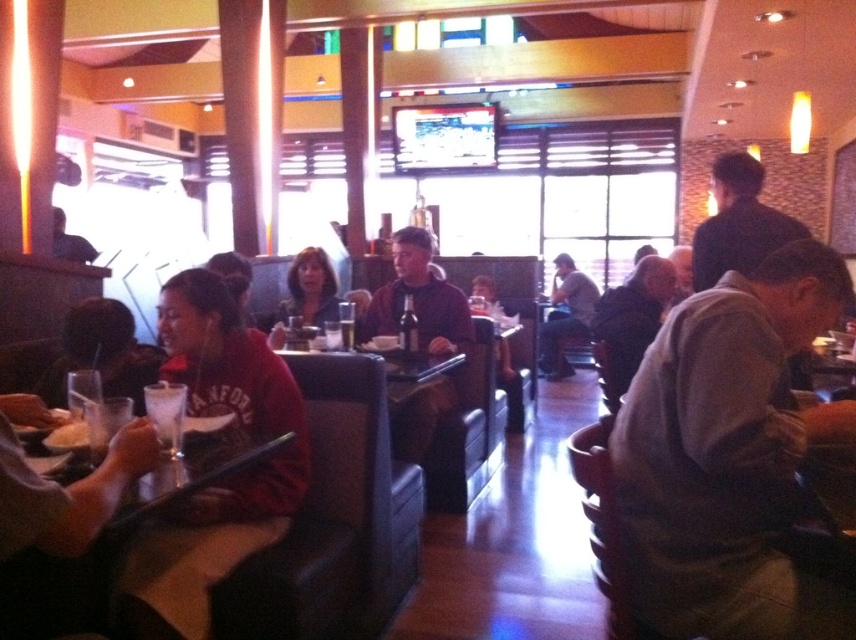
Question: Does gray fabric jacket at center appear over dark gray shirt at center?

Choices:
 (A) yes
 (B) no

Answer: (B)

Question: Based on their relative distances, which object is nearer to the dark brown hair at upper right?

Choices:
 (A) white paper plate at lower left
 (B) matte black hair at center

Answer: (B)

Question: Which of the following is the farthest from the observer?

Choices:
 (A) matte black hair at center
 (B) dark brown hair at upper right

Answer: (A)

Question: Which object appears closest to the camera in this image?

Choices:
 (A) brown sweater at center
 (B) dark gray shirt at center

Answer: (A)

Question: Can you confirm if matte red shirt at lower left is smaller than matte black hair at center?

Choices:
 (A) yes
 (B) no

Answer: (A)

Question: From the image, what is the correct spatial relationship of gray fabric jacket at center in relation to white paper plate at lower left?

Choices:
 (A) above
 (B) below

Answer: (A)